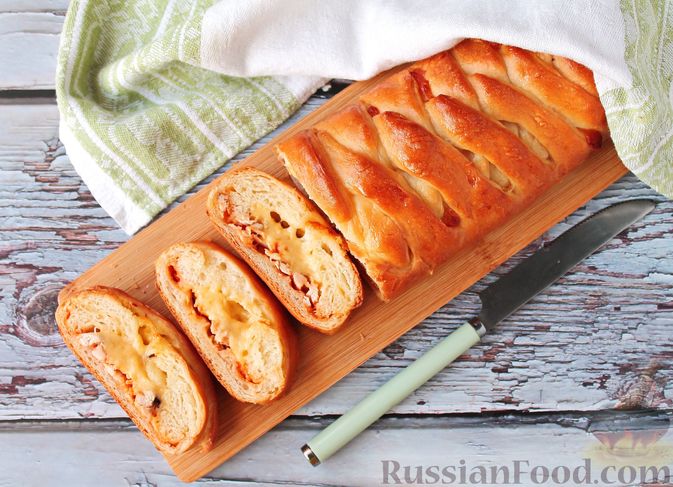
Where is `cutting board`? Image resolution: width=673 pixels, height=487 pixels. cutting board is located at coordinates (348, 343).